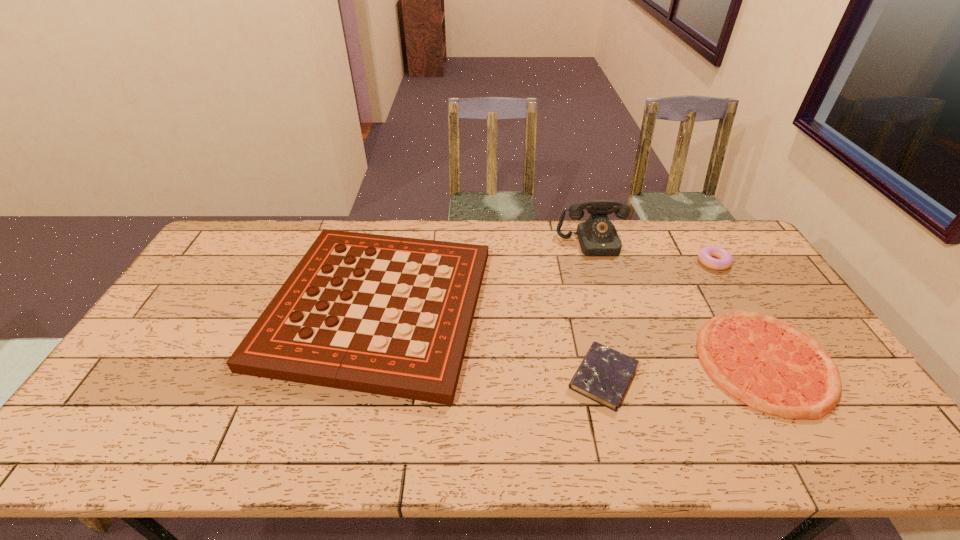
You are a GUI agent. You are given a task and a screenshot of the screen. Output one action in this format:
    pyautogui.click(x=<x>, y=<y>)
    Task: Click on the vacant area situated 0.110m on the right of the diary
    
    Given the screenshot: What is the action you would take?
    pyautogui.click(x=683, y=377)

Locate an element on the screen. The height and width of the screenshot is (540, 960). telephone situated at the far edge is located at coordinates (597, 236).

Locate an element on the screen. The height and width of the screenshot is (540, 960). gameboard that is at the far edge is located at coordinates (386, 315).

This screenshot has height=540, width=960. What are the coordinates of `doughnut present at the far edge` in the screenshot? It's located at (725, 259).

The height and width of the screenshot is (540, 960). I want to click on doughnut that is at the right edge, so click(x=725, y=259).

I want to click on pizza that is at the right edge, so click(x=772, y=366).

Locate an element on the screen. object that is positioned at the far right corner is located at coordinates (725, 259).

The height and width of the screenshot is (540, 960). I want to click on vacant space at the far edge of the desktop, so click(x=535, y=223).

In the image, there is a desktop. Where is `free space at the near edge`? free space at the near edge is located at coordinates (553, 448).

At what (x,y) coordinates should I click in order to perform the action: click on vacant region at the left edge. Please return your answer as a coordinate pair (x, y). The image size is (960, 540). Looking at the image, I should click on (190, 323).